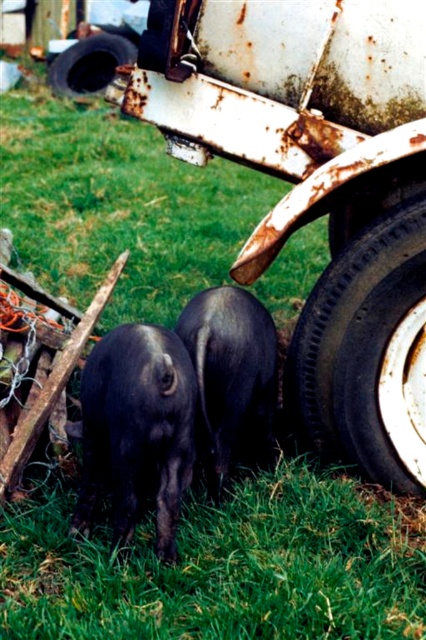
You are a farmer checking the field. You see the green grass at lower center and the shiny black pig at center. How far apart are these two objects?

The distance between the green grass at lower center and the shiny black pig at center is 20.37 inches.

You are a gardener who wants to plant a row of flowers along the edge of the green grass at lower center. Considering the space available, will the black rubber tire at lower right interfere with the planting area?

The green grass at lower center is wider than the black rubber tire at lower right, so there should be enough space to plant the flowers without interference from the tire.